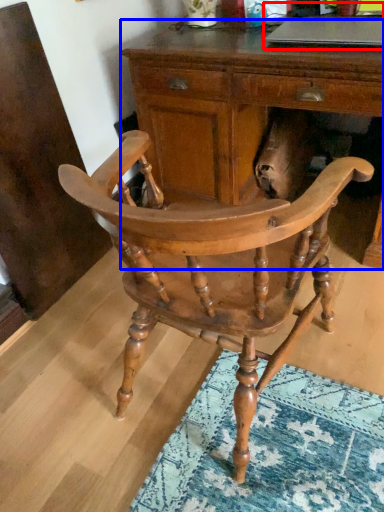
Question: Which of the following is the closest to the observer, computer (highlighted by a red box) or desk (highlighted by a blue box)?

Choices:
 (A) computer
 (B) desk

Answer: (B)